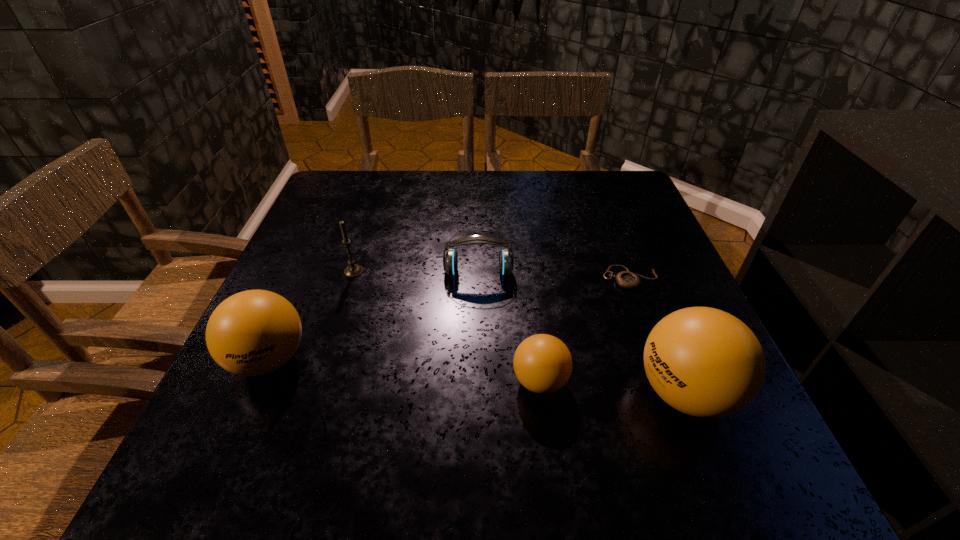
Where is `vacant space at the far edge`? vacant space at the far edge is located at coordinates (491, 189).

In the image, there is a desktop. Where is `free space at the near edge`? The image size is (960, 540). free space at the near edge is located at coordinates (496, 404).

Where is `vacant space at the left edge of the desktop`? This screenshot has width=960, height=540. vacant space at the left edge of the desktop is located at coordinates (305, 310).

This screenshot has width=960, height=540. In the image, there is a desktop. Identify the location of free space at the right edge. (689, 288).

Find the location of a particular element. Image resolution: width=960 pixels, height=540 pixels. vacant space at the far left corner of the desktop is located at coordinates (333, 199).

Locate an element on the screen. Image resolution: width=960 pixels, height=540 pixels. vacant space at the near left corner of the desktop is located at coordinates (254, 388).

What are the coordinates of `vacant position at the near right corner of the desktop` in the screenshot? It's located at (650, 386).

Locate an element on the screen. free space between the leftmost ping-pong ball and the second object from left to right is located at coordinates (311, 315).

Find the location of a particular element. The width and height of the screenshot is (960, 540). vacant space that is in between the second object from left to right and the headset is located at coordinates (416, 272).

Find the location of a particular element. This screenshot has height=540, width=960. free spot between the headset and the second ping-pong ball from left to right is located at coordinates (509, 327).